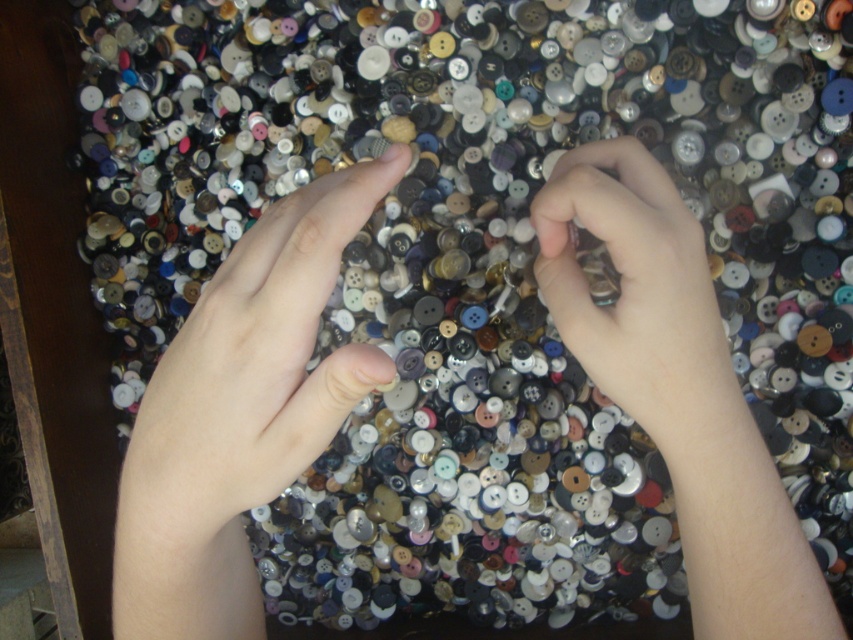
Where is `pale skin at center`? The height and width of the screenshot is (640, 853). pale skin at center is located at coordinates (250, 378).

Does pale skin at center have a larger size compared to matte plastic button at center?

Indeed, pale skin at center has a larger size compared to matte plastic button at center.

What are the coordinates of `pale skin at center` in the screenshot? It's located at (250, 378).

Can you confirm if smooth skin hands at center is thinner than matte plastic button at center?

No, smooth skin hands at center is not thinner than matte plastic button at center.

Between smooth skin hands at center and matte plastic button at center, which one is positioned higher?

matte plastic button at center is above.

Who is more forward, (310, 205) or (701, 275)?

Point (310, 205) is more forward.

I want to click on smooth skin hands at center, so click(x=239, y=413).

Can you confirm if smooth skin hands at center is shorter than pale skin at center?

No.

Does point (700, 472) come behind point (207, 300)?

Yes, point (700, 472) is farther from viewer.

Locate an element on the screen. smooth skin hands at center is located at coordinates (239, 413).